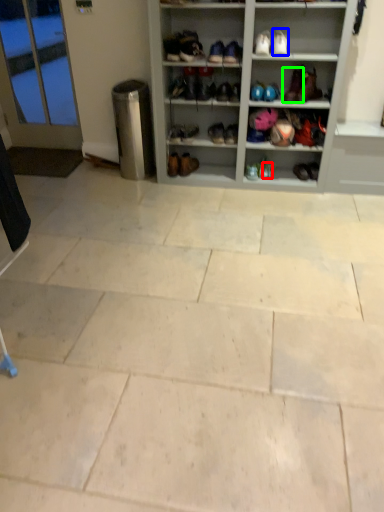
Question: Which is farther away from shoe (highlighted by a red box)? footwear (highlighted by a blue box) or footwear (highlighted by a green box)?

Choices:
 (A) footwear
 (B) footwear

Answer: (A)